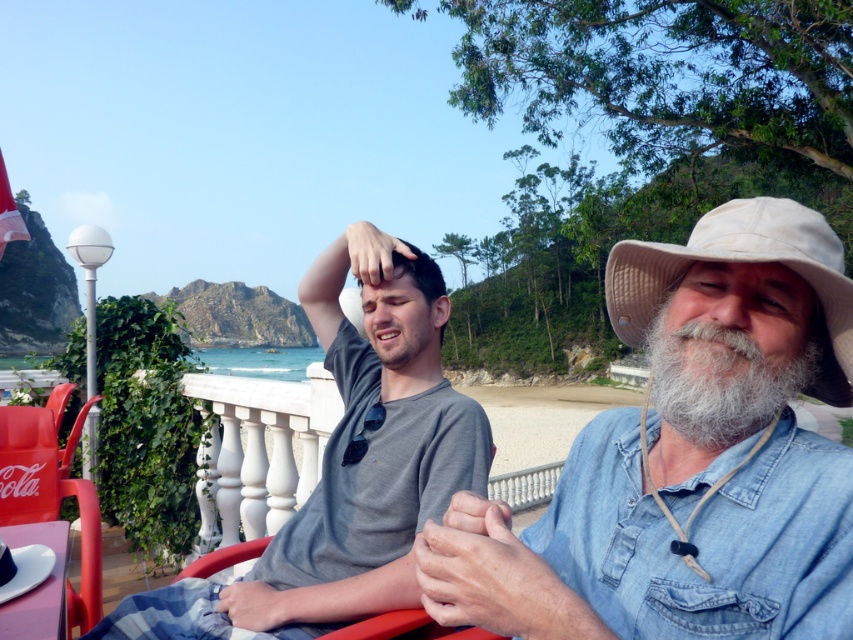
Can you confirm if gray/white/fuzzy beard at right is positioned to the right of matte plastic beach chair at lower left?

Yes, gray/white/fuzzy beard at right is to the right of matte plastic beach chair at lower left.

Which is more to the right, gray/white/fuzzy beard at right or matte plastic beach chair at lower left?

gray/white/fuzzy beard at right

Describe the element at coordinates (718, 380) in the screenshot. I see `gray/white/fuzzy beard at right` at that location.

The height and width of the screenshot is (640, 853). Identify the location of gray/white/fuzzy beard at right. (718, 380).

Does denim shirt at center appear on the right side of beige fabric cowboy hat at right?

In fact, denim shirt at center is to the left of beige fabric cowboy hat at right.

Is denim shirt at center below beige fabric cowboy hat at right?

Indeed, denim shirt at center is positioned under beige fabric cowboy hat at right.

Does point (618, 500) come closer to viewer compared to point (759, 209)?

No, (618, 500) is further to viewer.

Find the location of a particular element. denim shirt at center is located at coordinates (688, 458).

Can you confirm if beige fabric cowboy hat at right is wider than gray/white/fuzzy beard at right?

Yes.

Where is `beige fabric cowboy hat at right`? This screenshot has width=853, height=640. beige fabric cowboy hat at right is located at coordinates (746, 260).